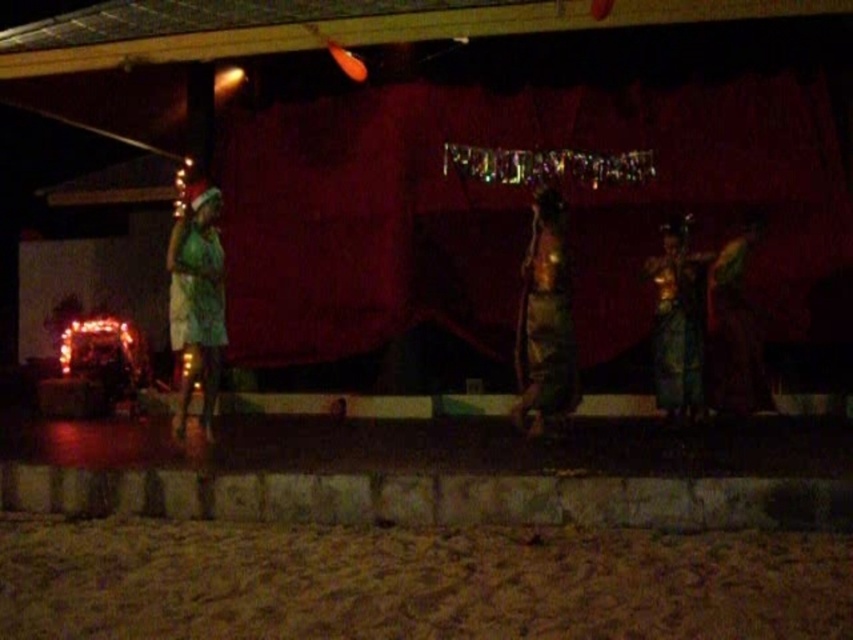
Is point (207, 193) positioned in front of point (740, 348)?

Yes.

Where is `green fabric dress at left`? green fabric dress at left is located at coordinates (196, 305).

From the picture: Can you confirm if green fabric dress at left is thinner than green silk dress at center?

Indeed, green fabric dress at left has a lesser width compared to green silk dress at center.

Based on the photo, which is more to the right, green fabric dress at left or green silk dress at center?

green silk dress at center

Which is behind, point (184, 227) or point (699, 369)?

Positioned behind is point (699, 369).

This screenshot has width=853, height=640. What are the coordinates of `green fabric dress at left` in the screenshot? It's located at (196, 305).

Which is more to the right, metallic gold statue at center or green fabric dress at right?

green fabric dress at right

Which is more to the left, metallic gold statue at center or green fabric dress at right?

From the viewer's perspective, metallic gold statue at center appears more on the left side.

Does point (566, 292) come closer to viewer compared to point (714, 384)?

Yes.

Find the location of a particular element. The height and width of the screenshot is (640, 853). metallic gold statue at center is located at coordinates (544, 321).